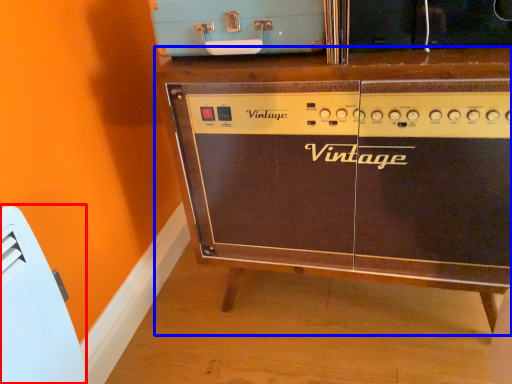
Question: Which object appears closest to the camera in this image, appliance (highlighted by a red box) or furniture (highlighted by a blue box)?

Choices:
 (A) appliance
 (B) furniture

Answer: (A)